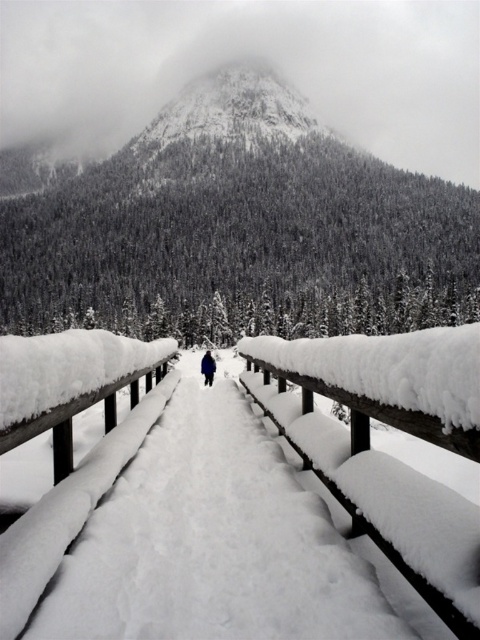
You are standing on the wooden boardwalk and want to take a photo of both the snowy textured mountain at upper center and the dark blue fabric skier at center. Which object should you focus on first if you want both to be in sharp focus?

The snowy textured mountain at upper center is taller than the dark blue fabric skier at center. Therefore, you should focus on the snowy textured mountain at upper center first to ensure both are in sharp focus.

You are standing on the wooden boardwalk and looking towards the snowy textured mountain at upper center. Can you see the dark blue fabric skier at center from your current position?

Yes, because the snowy textured mountain at upper center is positioned over the dark blue fabric skier at center, the skier is visible beneath the mountain in the scene.

You are a photographer planning to capture a winter landscape photo that includes both the wooden rail at center and the dark blue fabric skier at center. To ensure both objects are clearly visible in your shot, which object should you focus on first, the one closer to you or the one farther away?

The wooden rail at center is smaller in size compared to the dark blue fabric skier at center. To ensure both are clearly visible, focus on the closer object first as it requires more precise focus due to its smaller details.